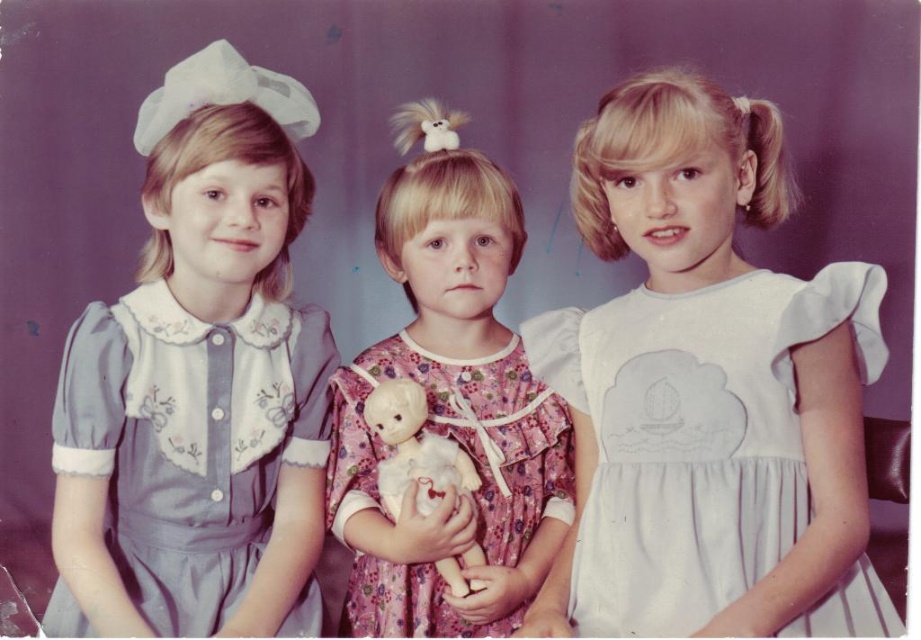
Describe the element at coordinates (190, 440) in the screenshot. The image size is (921, 640). I see `light blue cotton dress at left` at that location.

Does light blue cotton dress at left have a greater height compared to white plush doll at center?

Indeed, light blue cotton dress at left has a greater height compared to white plush doll at center.

Image resolution: width=921 pixels, height=640 pixels. What do you see at coordinates (190, 440) in the screenshot?
I see `light blue cotton dress at left` at bounding box center [190, 440].

What are the coordinates of `light blue cotton dress at left` in the screenshot? It's located at (190, 440).

Which is more to the left, white satin dress at center or white plush doll at center?

white plush doll at center

Consider the image. Can you confirm if white satin dress at center is thinner than white plush doll at center?

In fact, white satin dress at center might be wider than white plush doll at center.

Which is in front, point (799, 468) or point (468, 564)?

Point (799, 468) is in front.

At what (x,y) coordinates should I click in order to perform the action: click on white satin dress at center. Please return your answer as a coordinate pair (x, y). This screenshot has height=640, width=921. Looking at the image, I should click on (694, 436).

Is light blue cotton dress at left to the left of floral cotton dress at center from the viewer's perspective?

Yes, light blue cotton dress at left is to the left of floral cotton dress at center.

Does point (106, 518) come farther from viewer compared to point (503, 474)?

Yes.

The image size is (921, 640). Find the location of `light blue cotton dress at left`. light blue cotton dress at left is located at coordinates (190, 440).